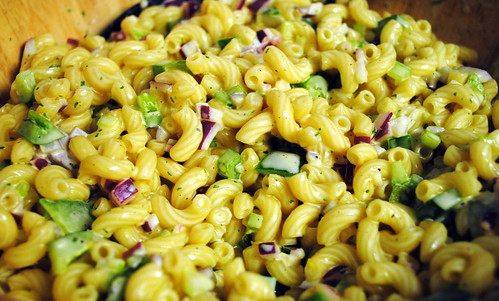
The width and height of the screenshot is (499, 301). I want to click on left side of bowl, so (40, 17).